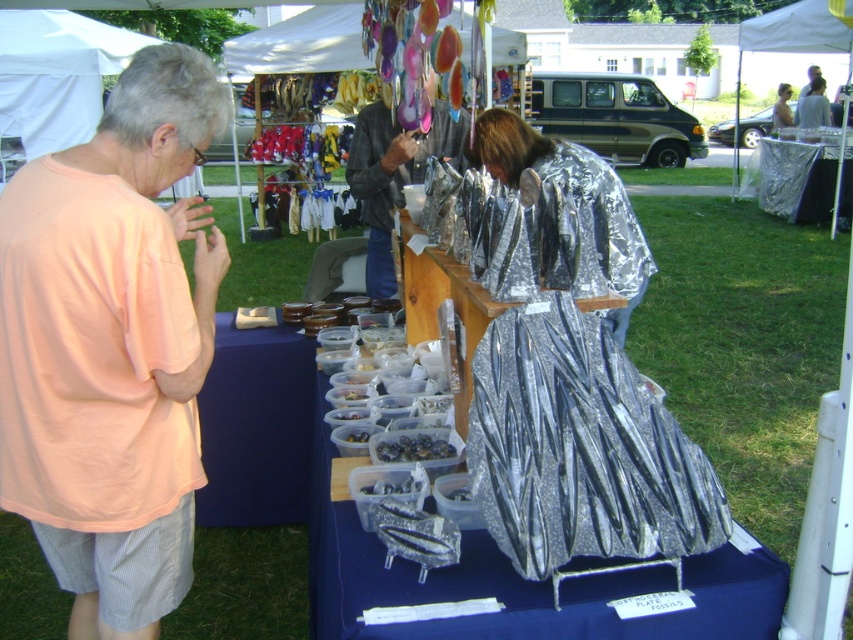
What do you see at coordinates (579, 448) in the screenshot?
I see `silver reflective foil at center` at bounding box center [579, 448].

Between silver reflective foil at center and shiny metallic dress at center, which one appears on the left side from the viewer's perspective?

silver reflective foil at center

Does point (561, 497) come behind point (628, 314)?

That is False.

The width and height of the screenshot is (853, 640). What are the coordinates of `silver reflective foil at center` in the screenshot? It's located at (579, 448).

Between metallic silver plate at center and metallic silver dress at center, which one appears on the right side from the viewer's perspective?

From the viewer's perspective, metallic silver dress at center appears more on the right side.

Is metallic silver plate at center taller than metallic silver dress at center?

No, metallic silver plate at center is not taller than metallic silver dress at center.

This screenshot has width=853, height=640. Describe the element at coordinates (440, 301) in the screenshot. I see `metallic silver plate at center` at that location.

Locate an element on the screen. This screenshot has width=853, height=640. metallic silver plate at center is located at coordinates (440, 301).

Who is lower down, shiny metallic jacket at center or metallic silver plate at center?

metallic silver plate at center

You are a GUI agent. You are given a task and a screenshot of the screen. Output one action in this format:
    pyautogui.click(x=<x>, y=<y>)
    Task: Click on the shiny metallic jacket at center
    The height and width of the screenshot is (640, 853).
    Given the screenshot: What is the action you would take?
    pyautogui.click(x=395, y=173)